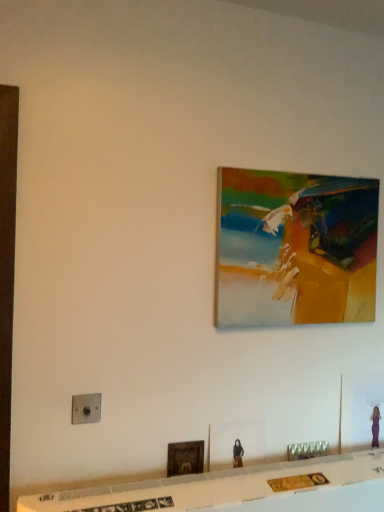
Question: Which direction should I rotate to face oil painting at upper center, positioned as the first picture frame in top-to-bottom order, — up or down?

Choices:
 (A) down
 (B) up

Answer: (B)

Question: Is the depth of oil painting at upper center, the second picture frame ordered from the bottom, greater than that of satin silver switch at lower left?

Choices:
 (A) no
 (B) yes

Answer: (B)

Question: Is oil painting at upper center, which is the 1th picture frame from right to left, looking in the opposite direction of satin silver switch at lower left?

Choices:
 (A) yes
 (B) no

Answer: (B)

Question: Could you tell me if oil painting at upper center, marked as the 2th picture frame in a front-to-back arrangement, is turned towards satin silver switch at lower left?

Choices:
 (A) yes
 (B) no

Answer: (B)

Question: From the image's perspective, is oil painting at upper center, which is the 1th picture frame from right to left, located beneath satin silver switch at lower left?

Choices:
 (A) yes
 (B) no

Answer: (B)

Question: Is oil painting at upper center, marked as the 2th picture frame in a front-to-back arrangement, smaller than satin silver switch at lower left?

Choices:
 (A) yes
 (B) no

Answer: (B)

Question: Can you confirm if oil painting at upper center, which ranks as the second picture frame in left-to-right order, is wider than satin silver switch at lower left?

Choices:
 (A) yes
 (B) no

Answer: (A)

Question: Is oil painting at upper center, the 1th picture frame from the back, positioned far away from metallic gold decorative piece at lower center?

Choices:
 (A) yes
 (B) no

Answer: (B)

Question: Is oil painting at upper center, the second picture frame ordered from the bottom, positioned beyond the bounds of metallic gold decorative piece at lower center?

Choices:
 (A) no
 (B) yes

Answer: (B)

Question: Does oil painting at upper center, the second picture frame ordered from the bottom, have a larger size compared to metallic gold decorative piece at lower center?

Choices:
 (A) no
 (B) yes

Answer: (B)

Question: Is oil painting at upper center, the 1th picture frame from the back, positioned before metallic gold decorative piece at lower center?

Choices:
 (A) yes
 (B) no

Answer: (A)

Question: Does oil painting at upper center, which is the 1th picture frame from right to left, have a greater width compared to metallic gold decorative piece at lower center?

Choices:
 (A) no
 (B) yes

Answer: (B)

Question: From a real-world perspective, does oil painting at upper center, the second picture frame ordered from the bottom, stand above metallic gold decorative piece at lower center?

Choices:
 (A) no
 (B) yes

Answer: (B)

Question: From a real-world perspective, is metallic gold decorative piece at lower center physically above oil painting at upper center, which ranks as the second picture frame in left-to-right order?

Choices:
 (A) yes
 (B) no

Answer: (B)